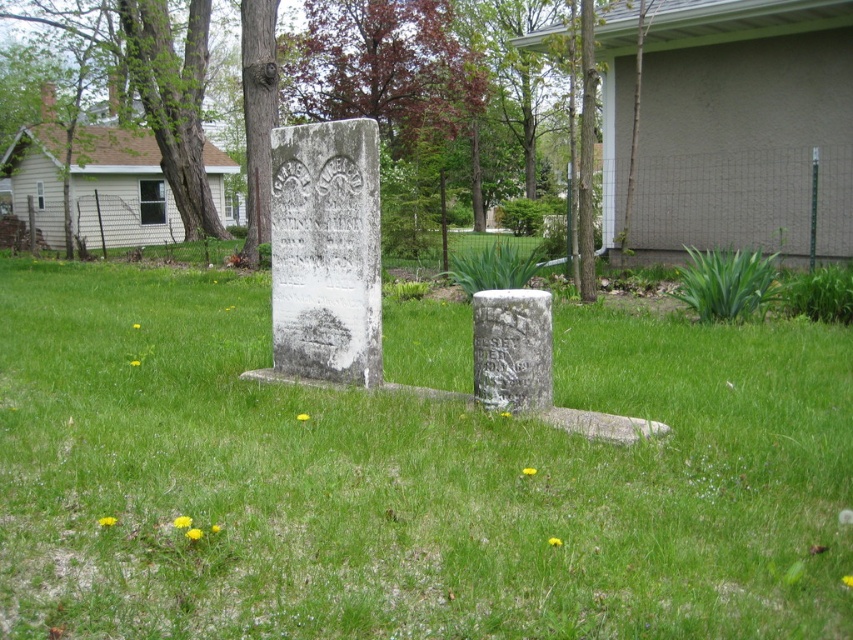
Question: Which object is closer to the camera taking this photo?

Choices:
 (A) green grass at center
 (B) green rough bark tree at upper left
 (C) white stone gravestone at center

Answer: (A)

Question: Does green rough bark tree at upper left appear under white stone gravestone at center?

Choices:
 (A) yes
 (B) no

Answer: (B)

Question: Can you confirm if green grass at center is bigger than white stone gravestone at center?

Choices:
 (A) no
 (B) yes

Answer: (B)

Question: Based on their relative distances, which object is farther from the green grass at center?

Choices:
 (A) green rough bark tree at upper left
 (B) white stone gravestone at center

Answer: (A)

Question: Among these objects, which one is farthest from the camera?

Choices:
 (A) green grass at center
 (B) white stone gravestone at center
 (C) green rough bark tree at upper left

Answer: (C)

Question: Can you confirm if green grass at center is bigger than white stone gravestone at center?

Choices:
 (A) yes
 (B) no

Answer: (A)